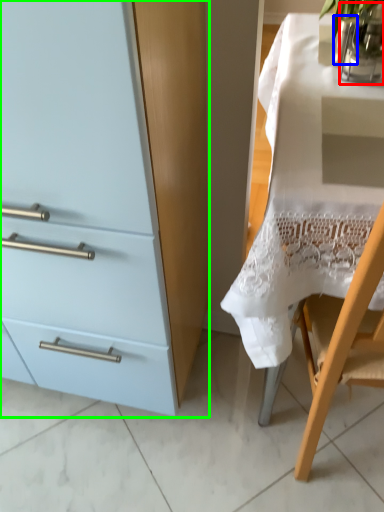
Question: Which object is the closest to the glass vase (highlighted by a red box)? Choose among these: glass vase (highlighted by a blue box) or cabinetry (highlighted by a green box).

Choices:
 (A) glass vase
 (B) cabinetry

Answer: (A)